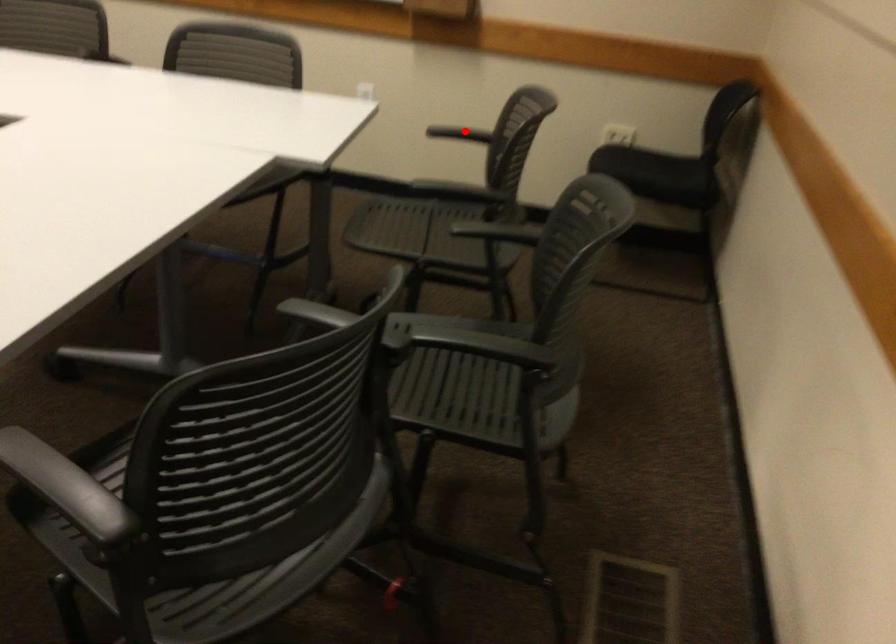
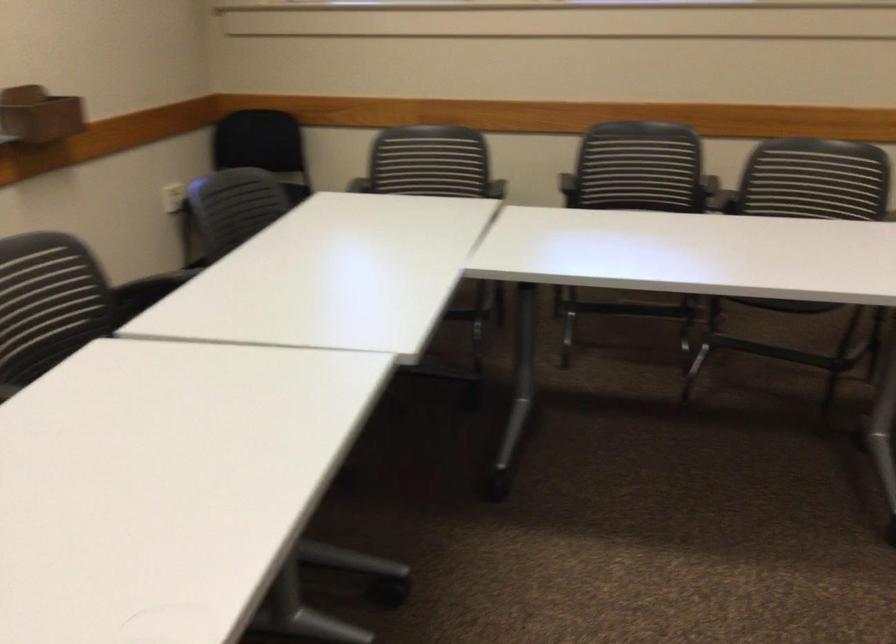
Question: I am providing you with two images of the same scene from different viewpoints. A red point is marked on the first image. Is the red point's position out of view in image 2?

Choices:
 (A) Yes
 (B) No

Answer: (A)